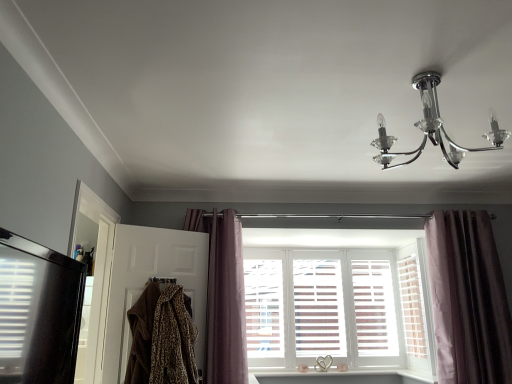
Question: Is brown fur coat at left, which ranks as the 1th screen door in right-to-left order, taller than white wood shutter at center?

Choices:
 (A) no
 (B) yes

Answer: (A)

Question: Can you confirm if brown fur coat at left, which ranks as the 1th screen door in right-to-left order, is bigger than white wood shutter at center?

Choices:
 (A) yes
 (B) no

Answer: (A)

Question: Are brown fur coat at left, which appears as the 2th screen door when viewed from the left, and white wood shutter at center located far from each other?

Choices:
 (A) yes
 (B) no

Answer: (A)

Question: Considering the relative sizes of brown fur coat at left, which appears as the 2th screen door when viewed from the left, and white wood shutter at center in the image provided, is brown fur coat at left, which appears as the 2th screen door when viewed from the left, wider than white wood shutter at center?

Choices:
 (A) no
 (B) yes

Answer: (B)

Question: Is brown fur coat at left, which appears as the 2th screen door when viewed from the left, smaller than white wood shutter at center?

Choices:
 (A) no
 (B) yes

Answer: (A)

Question: Is point (81, 208) closer or farther from the camera than point (150, 292)?

Choices:
 (A) closer
 (B) farther

Answer: (A)

Question: In terms of width, does black glossy refrigerator at left, placed as the 1th screen door when sorted from left to right, look wider or thinner when compared to leopard print fabric at lower left?

Choices:
 (A) thin
 (B) wide

Answer: (A)

Question: From a real-world perspective, is black glossy refrigerator at left, placed as the 1th screen door when sorted from left to right, physically located above or below leopard print fabric at lower left?

Choices:
 (A) above
 (B) below

Answer: (A)

Question: Would you say black glossy refrigerator at left, placed as the 1th screen door when sorted from left to right, is to the left or to the right of leopard print fabric at lower left in the picture?

Choices:
 (A) right
 (B) left

Answer: (B)

Question: From the image's perspective, is mauve velvet curtain at center, arranged as the 1th curtain when viewed from the left, above or below velvet purple curtain at right, which ranks as the second curtain in left-to-right order?

Choices:
 (A) above
 (B) below

Answer: (A)

Question: Is mauve velvet curtain at center, the second curtain when ordered from right to left, taller or shorter than velvet purple curtain at right, which ranks as the second curtain in left-to-right order?

Choices:
 (A) tall
 (B) short

Answer: (B)

Question: From a real-world perspective, is mauve velvet curtain at center, arranged as the 1th curtain when viewed from the left, above or below velvet purple curtain at right, the first curtain viewed from the right?

Choices:
 (A) below
 (B) above

Answer: (B)

Question: Looking at their shapes, would you say mauve velvet curtain at center, the second curtain when ordered from right to left, is wider or thinner than velvet purple curtain at right, which ranks as the second curtain in left-to-right order?

Choices:
 (A) thin
 (B) wide

Answer: (A)

Question: Relative to black glossy refrigerator at left, acting as the second screen door starting from the right, is leopard print fabric at lower left in front or behind?

Choices:
 (A) behind
 (B) front

Answer: (A)

Question: From the image's perspective, is leopard print fabric at lower left positioned above or below black glossy refrigerator at left, placed as the 1th screen door when sorted from left to right?

Choices:
 (A) above
 (B) below

Answer: (B)